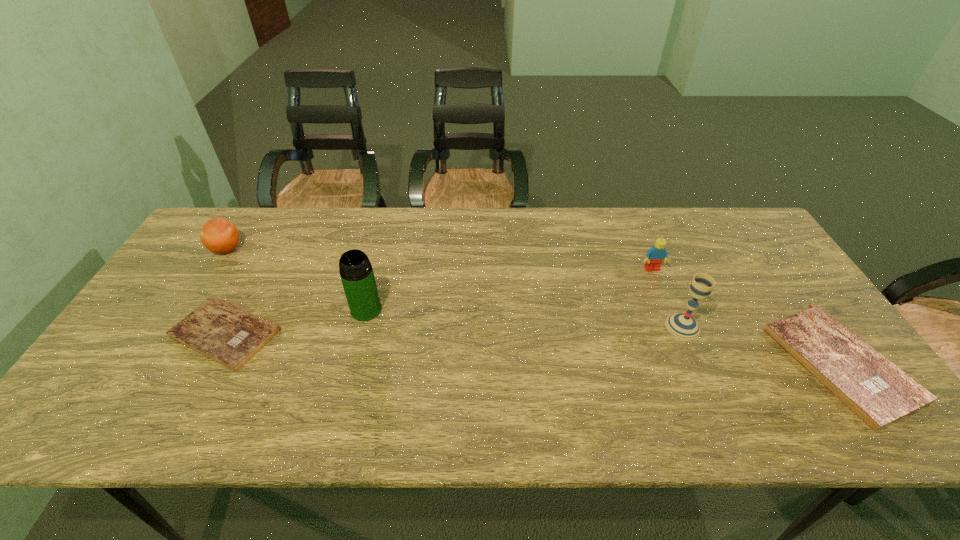
You are a GUI agent. You are given a task and a screenshot of the screen. Output one action in this format:
    pyautogui.click(x=<x>, y=<y>)
    Task: Click on the free point between the fifth shortest object and the fourth object from right to left
    
    Given the screenshot: What is the action you would take?
    pyautogui.click(x=524, y=318)

Locate an element on the screen. vacant space that's between the thermos bottle and the fifth nearest object is located at coordinates (509, 289).

I want to click on vacant space in between the orange and the third object from left to right, so click(x=297, y=280).

Where is `vacant area that lies between the chalice and the right Bible`? vacant area that lies between the chalice and the right Bible is located at coordinates [x=761, y=345].

At what (x,y) coordinates should I click in order to perform the action: click on empty location between the chalice and the orange. Please return your answer as a coordinate pair (x, y). This screenshot has width=960, height=540. Looking at the image, I should click on (455, 288).

Locate an element on the screen. The image size is (960, 540). empty space between the right Bible and the orange is located at coordinates (533, 306).

Where is `vacant region between the second farthest object and the left Bible`? vacant region between the second farthest object and the left Bible is located at coordinates (439, 301).

What are the coordinates of `vacant area that lies between the fifth nearest object and the second tallest object` in the screenshot? It's located at (667, 298).

Locate an element on the screen. This screenshot has height=540, width=960. the closest object to the fourth object from right to left is located at coordinates (227, 334).

Select which object is the fifth closest to the right Bible. Please provide its 2D coordinates. Your answer should be formatted as a tuple, i.e. [(x, y)], where the tuple contains the x and y coordinates of a point satisfying the conditions above.

[(219, 235)]